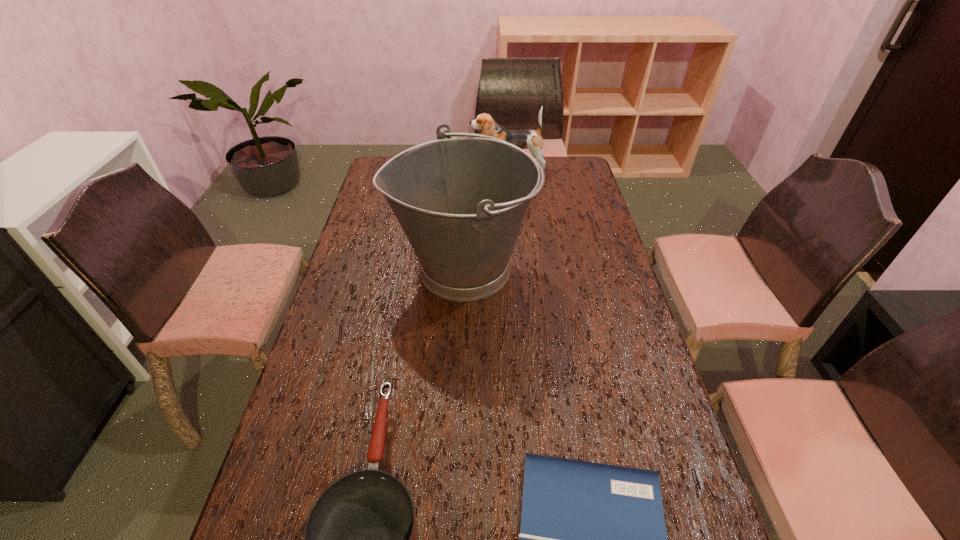
Find the location of `bucket`. bucket is located at coordinates (461, 201).

Find the location of a particular element. This screenshot has height=540, width=960. the tallest object is located at coordinates (461, 201).

Identify the location of the farthest object. click(525, 139).

Find the location of a particular element. The image size is (960, 540). puppy is located at coordinates (525, 139).

The image size is (960, 540). What are the coordinates of `free space located 0.270m on the front of the third nearest object` in the screenshot? It's located at 456,405.

Locate an element on the screen. This screenshot has height=540, width=960. free space located 0.180m at the face of the farthest object is located at coordinates (429, 169).

Where is `vacant area located at the face of the farthest object`? vacant area located at the face of the farthest object is located at coordinates (392, 169).

This screenshot has width=960, height=540. Identify the location of free space located at the face of the farthest object. (395, 169).

Identify the location of object that is positioned at the far edge. The height and width of the screenshot is (540, 960). (525, 139).

Locate an element on the screen. The width and height of the screenshot is (960, 540). object that is at the left edge is located at coordinates (461, 201).